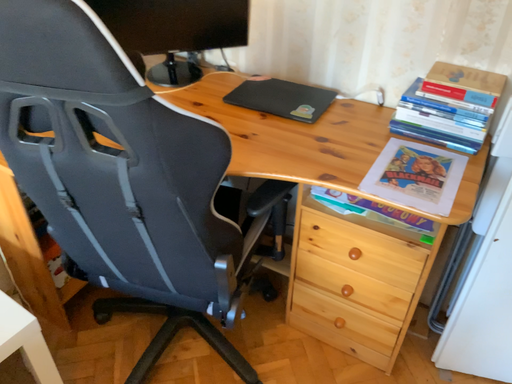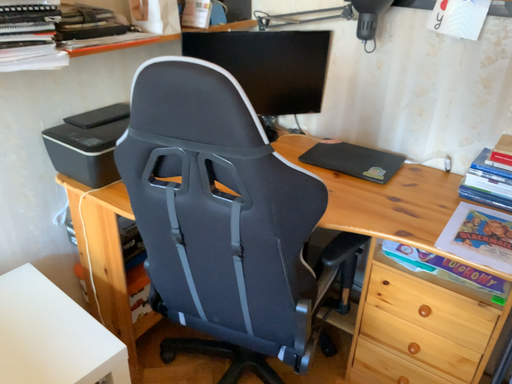
Question: How did the camera likely rotate when shooting the video?

Choices:
 (A) rotated upward
 (B) rotated downward

Answer: (A)